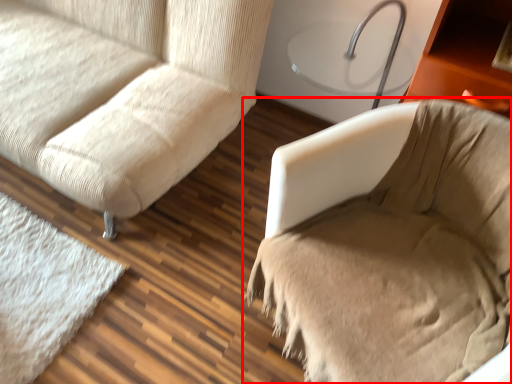
Question: Where is furniture (annotated by the red box) located in relation to studio couch in the image?

Choices:
 (A) left
 (B) right

Answer: (B)